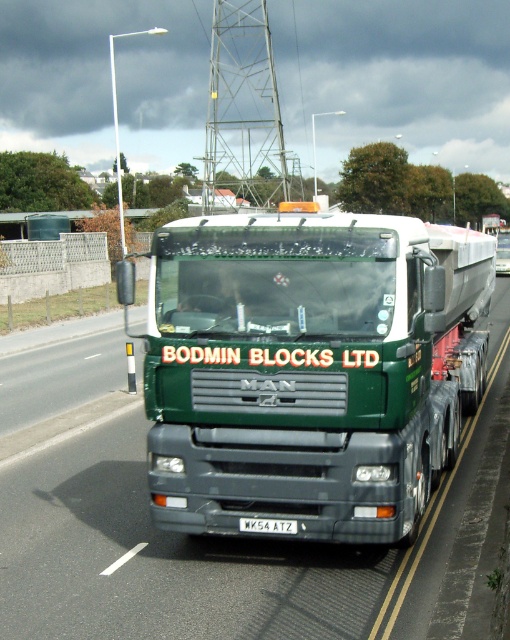
Question: Is green matte truck at center smaller than white metallic license plate at center?

Choices:
 (A) no
 (B) yes

Answer: (A)

Question: Among these points, which one is nearest to the camera?

Choices:
 (A) (253, 518)
 (B) (332, 522)

Answer: (B)

Question: Is green matte truck at center bigger than white metallic license plate at center?

Choices:
 (A) no
 (B) yes

Answer: (B)

Question: Is green matte truck at center positioned before white metallic license plate at center?

Choices:
 (A) yes
 (B) no

Answer: (A)

Question: Which of the following is the closest to the observer?

Choices:
 (A) (257, 524)
 (B) (367, 416)

Answer: (B)